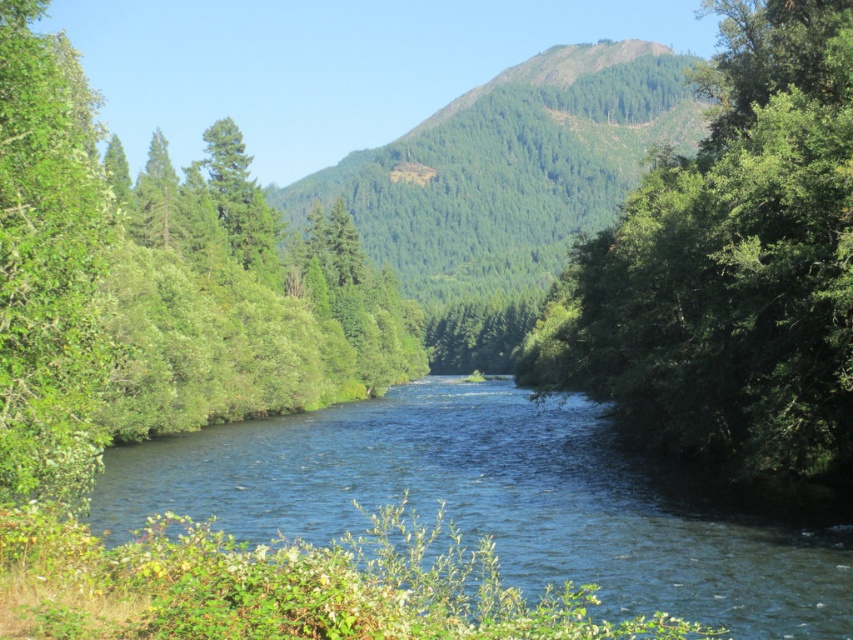
You are standing at the riverbank and see the green leafy tree at left and the green textured trees at center. Which tree is positioned more to the left?

The green leafy tree at left is positioned more to the left than the green textured trees at center.

You are standing at the edge of the river and see two green leafy trees in the scene. Which one is positioned higher up in the image, the green leafy tree at center or the green leafy tree at left?

The green leafy tree at center is positioned higher up in the image than the green leafy tree at left.